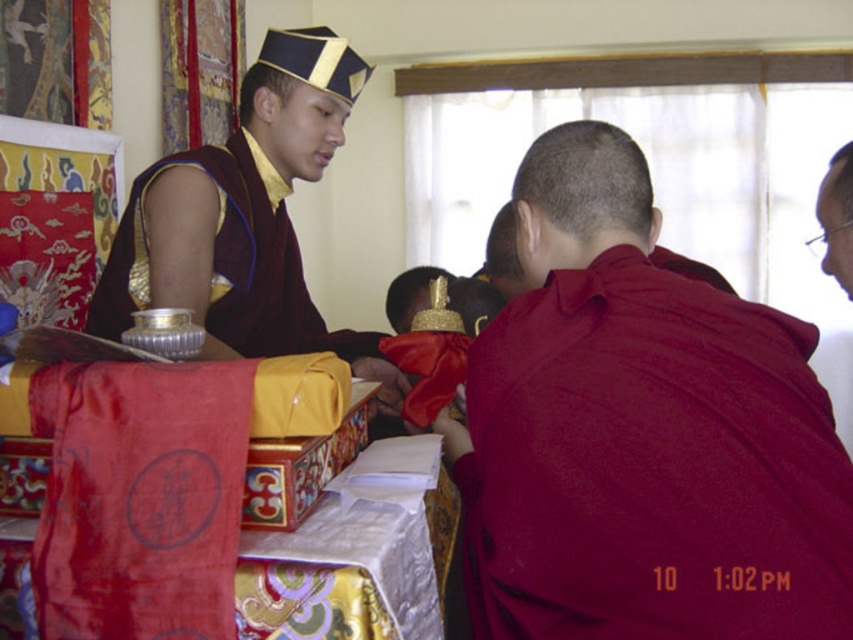
Based on the scene description, which object is positioned lower between the smooth maroon robe at center and the maroon silk robe at center?

The smooth maroon robe at center is positioned lower than the maroon silk robe at center according to the description.

You are a photographer at the event and want to capture both the smooth maroon robe at center and the maroon silk robe at center in the same frame. Which robe should you focus on to ensure both are visible without cropping?

The smooth maroon robe at center is larger in size than maroon silk robe at center, so focusing on the larger smooth maroon robe at center will ensure both are visible without cropping.